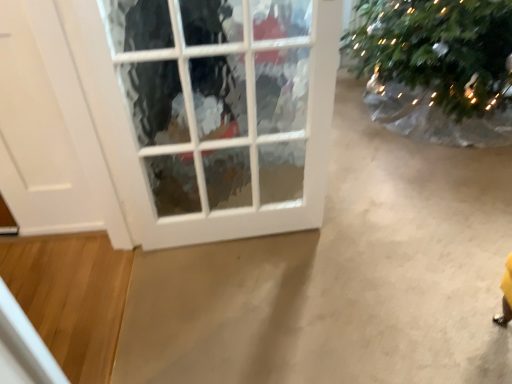
Measure the distance between point [68,149] and camera.

5.72 feet.

Describe the element at coordinates (214, 112) in the screenshot. I see `white glass window at center` at that location.

You are a GUI agent. You are given a task and a screenshot of the screen. Output one action in this format:
    pyautogui.click(x=<x>, y=<y>)
    Task: Click on the white glass window at center
    
    Given the screenshot: What is the action you would take?
    pyautogui.click(x=214, y=112)

I want to click on white matte door at left, so click(x=37, y=140).

From the image's perspective, which one is positioned higher, white glass window at center or white matte door at left?

white matte door at left, from the image's perspective.

How many degrees apart are the facing directions of white glass window at center and white matte door at left?

They differ by 12.5 degrees in their facing directions.

Is white matte door at left located within white glass window at center?

No, white matte door at left is not surrounded by white glass window at center.

From a real-world perspective, between green textured christmas tree at upper right and white matte door at left, who is vertically higher?

From a 3D spatial view, white matte door at left is above.

From the picture: From the image's perspective, relative to white matte door at left, is green textured christmas tree at upper right above or below?

From the image's perspective, green textured christmas tree at upper right appears above white matte door at left.

Would you say green textured christmas tree at upper right contains white matte door at left?

No.

Can you tell me how much white glass window at center and green textured christmas tree at upper right differ in facing direction?

They differ by 10.4 degrees in their facing directions.

From the picture: Is white glass window at center to the left or to the right of green textured christmas tree at upper right in the image?

Clearly, white glass window at center is on the left of green textured christmas tree at upper right in the image.

Is point (278, 206) less distant than point (472, 105)?

Yes.

Considering the sizes of white glass window at center and green textured christmas tree at upper right in the image, is white glass window at center bigger or smaller than green textured christmas tree at upper right?

Considering their sizes, white glass window at center takes up more space than green textured christmas tree at upper right.

From the picture: Who is bigger, white matte door at left or white glass window at center?

white glass window at center is bigger.

From the picture: Could you tell me if white matte door at left is facing white glass window at center?

No, white matte door at left is not oriented towards white glass window at center.

At what (x,y) coordinates should I click in order to perform the action: click on door above the white glass window at center (from the image's perspective). Please return your answer as a coordinate pair (x, y). The height and width of the screenshot is (384, 512). Looking at the image, I should click on (37, 140).

Can you confirm if white matte door at left is shorter than white glass window at center?

Indeed, white matte door at left has a lesser height compared to white glass window at center.

Does green textured christmas tree at upper right have a greater width compared to white glass window at center?

Incorrect, the width of green textured christmas tree at upper right does not surpass that of white glass window at center.

Would you say green textured christmas tree at upper right is to the left or to the right of white glass window at center in the picture?

In the image, green textured christmas tree at upper right appears on the right side of white glass window at center.

Is green textured christmas tree at upper right next to white glass window at center?

They are not placed beside each other.

Between white matte door at left and green textured christmas tree at upper right, which one has smaller width?

white matte door at left.

Considering the points (9, 42) and (441, 79), which point is behind, point (9, 42) or point (441, 79)?

The point (441, 79) is more distant.

From the image's perspective, is white matte door at left located above or below green textured christmas tree at upper right?

Clearly, from the image's perspective, white matte door at left is below green textured christmas tree at upper right.

Between white matte door at left and green textured christmas tree at upper right, which one appears on the right side from the viewer's perspective?

Positioned to the right is green textured christmas tree at upper right.

Find the location of a particular element. This screenshot has width=512, height=384. window positioned vertically above the white matte door at left (from a real-world perspective) is located at coordinates (214, 112).

Where is `christmas tree that is under the white matte door at left (from a real-world perspective)`? This screenshot has width=512, height=384. christmas tree that is under the white matte door at left (from a real-world perspective) is located at coordinates [x=438, y=50].

When comparing their distances from green textured christmas tree at upper right, does white glass window at center or white matte door at left seem closer?

white glass window at center.

When comparing their distances from green textured christmas tree at upper right, does white matte door at left or white glass window at center seem further?

Based on the image, white matte door at left appears to be further to green textured christmas tree at upper right.

Looking at the image, which one is located closer to white glass window at center, white matte door at left or green textured christmas tree at upper right?

white matte door at left lies closer to white glass window at center than the other object.

Considering their positions, is green textured christmas tree at upper right positioned closer to white matte door at left than white glass window at center?

white glass window at center lies closer to white matte door at left than the other object.

Looking at the image, which one is located closer to white matte door at left, white glass window at center or green textured christmas tree at upper right?

white glass window at center.

Based on their spatial positions, is green textured christmas tree at upper right or white matte door at left closer to white glass window at center?

Based on the image, white matte door at left appears to be nearer to white glass window at center.

The image size is (512, 384). Find the location of `window situated between white matte door at left and green textured christmas tree at upper right from left to right`. window situated between white matte door at left and green textured christmas tree at upper right from left to right is located at coordinates (214, 112).